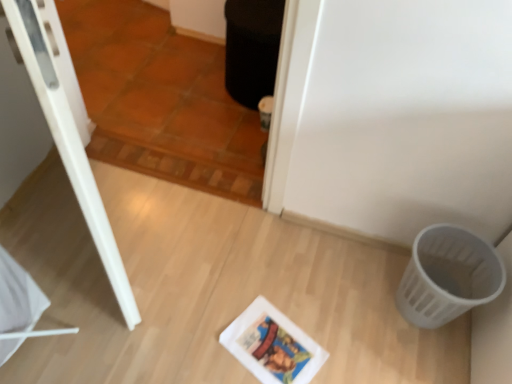
Identify the location of vacant area that lies in front of white plastic basket at lower right. This screenshot has width=512, height=384. (419, 365).